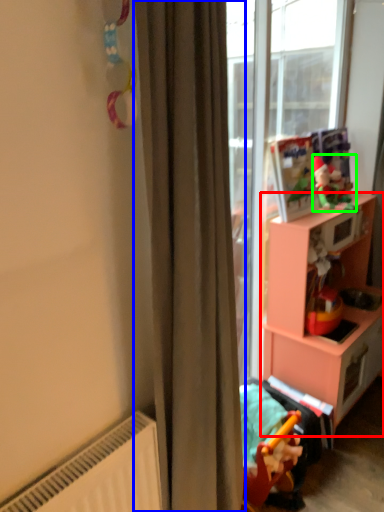
Question: Considering the real-world distances, which object is farthest from cabinetry (highlighted by a red box)? curtain (highlighted by a blue box) or toy (highlighted by a green box)?

Choices:
 (A) curtain
 (B) toy

Answer: (A)